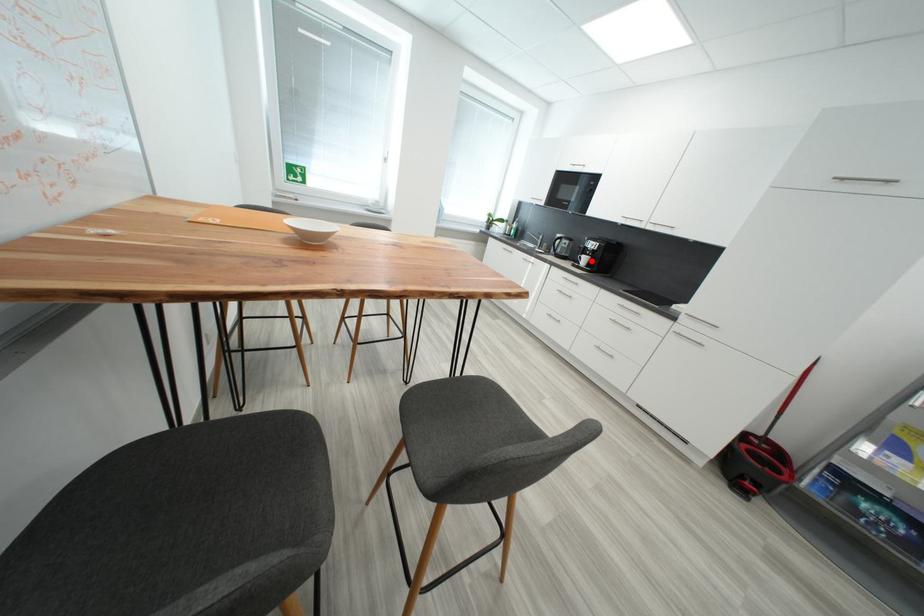
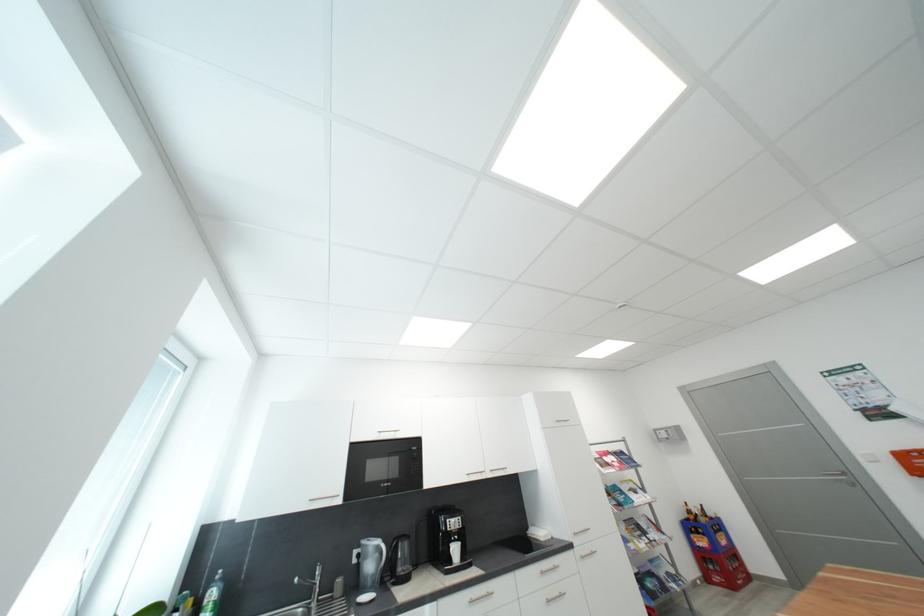
Find the pixel in the second image that matches the highlighted location in the first image.

(463, 552)